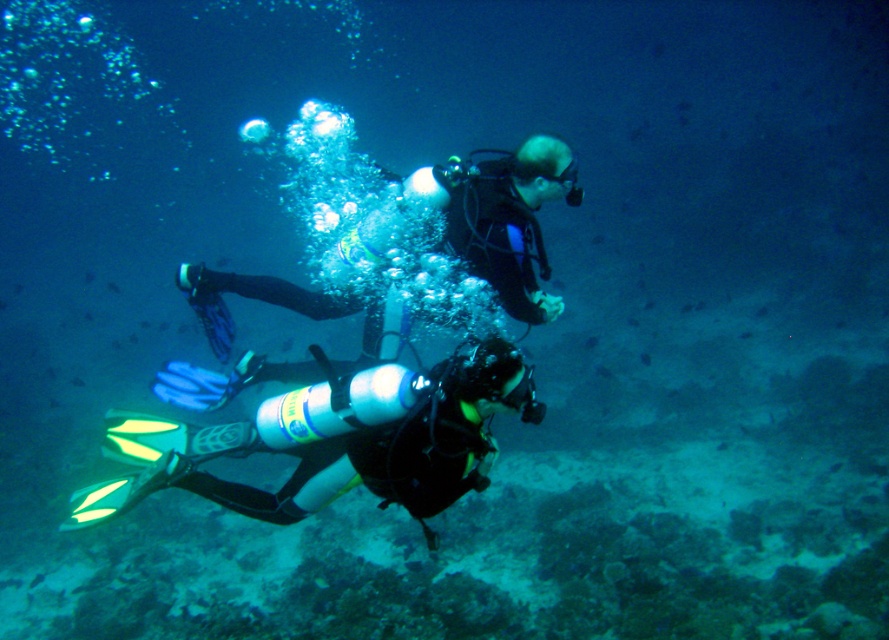
Which is below, neon yellow fins at center or black matte scuba diver at center?

neon yellow fins at center is below.

Which of these two, neon yellow fins at center or black matte scuba diver at center, stands shorter?

Standing shorter between the two is neon yellow fins at center.

At what (x,y) coordinates should I click in order to perform the action: click on neon yellow fins at center. Please return your answer as a coordinate pair (x, y). This screenshot has width=889, height=640. Looking at the image, I should click on (337, 442).

Image resolution: width=889 pixels, height=640 pixels. Identify the location of neon yellow fins at center. (337, 442).